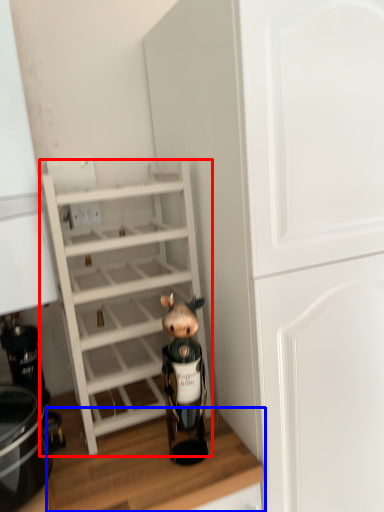
Question: Among these objects, which one is farthest to the camera, shelf (highlighted by a red box) or counter top (highlighted by a blue box)?

Choices:
 (A) shelf
 (B) counter top

Answer: (A)